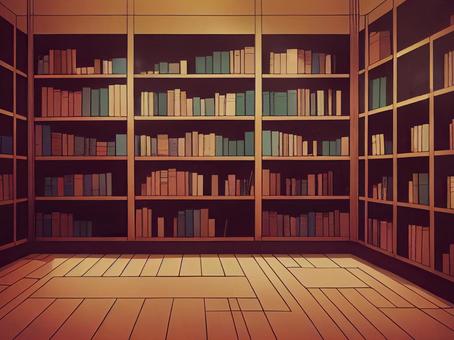
Identify the location of column cubbies far left. (9, 41), (4, 93), (4, 130), (3, 174), (6, 223).